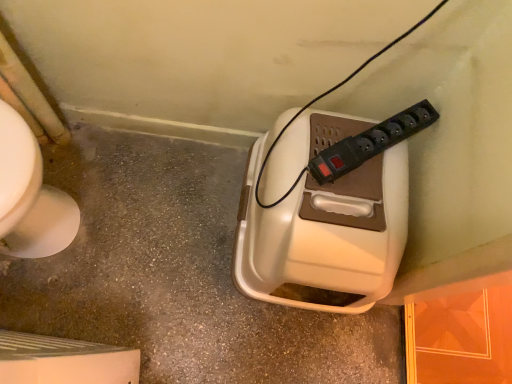
Question: Should I look upward or downward to see black plastic power plugs and sockets at upper center?

Choices:
 (A) up
 (B) down

Answer: (A)

Question: Is white plastic hand dryer at center facing towards black plastic power plugs and sockets at upper center?

Choices:
 (A) no
 (B) yes

Answer: (A)

Question: Is black plastic power plugs and sockets at upper center surrounded by white plastic hand dryer at center?

Choices:
 (A) yes
 (B) no

Answer: (B)

Question: Is white plastic hand dryer at center closer to the viewer compared to black plastic power plugs and sockets at upper center?

Choices:
 (A) no
 (B) yes

Answer: (B)

Question: Does white plastic hand dryer at center have a lesser width compared to black plastic power plugs and sockets at upper center?

Choices:
 (A) yes
 (B) no

Answer: (B)

Question: Does white plastic hand dryer at center appear on the left side of black plastic power plugs and sockets at upper center?

Choices:
 (A) no
 (B) yes

Answer: (B)

Question: Can you confirm if white plastic hand dryer at center is smaller than black plastic power plugs and sockets at upper center?

Choices:
 (A) no
 (B) yes

Answer: (A)

Question: Is white plastic hand dryer at center oriented towards beige plastic container at center?

Choices:
 (A) yes
 (B) no

Answer: (B)

Question: Is white plastic hand dryer at center shorter than beige plastic container at center?

Choices:
 (A) yes
 (B) no

Answer: (B)

Question: From the image's perspective, is white plastic hand dryer at center below beige plastic container at center?

Choices:
 (A) no
 (B) yes

Answer: (A)

Question: Is white plastic hand dryer at center outside of beige plastic container at center?

Choices:
 (A) yes
 (B) no

Answer: (A)

Question: Is white plastic hand dryer at center smaller than beige plastic container at center?

Choices:
 (A) yes
 (B) no

Answer: (B)

Question: Is white plastic hand dryer at center looking in the opposite direction of beige plastic container at center?

Choices:
 (A) no
 (B) yes

Answer: (A)

Question: Is beige plastic container at center facing away from white plastic hand dryer at center?

Choices:
 (A) no
 (B) yes

Answer: (A)